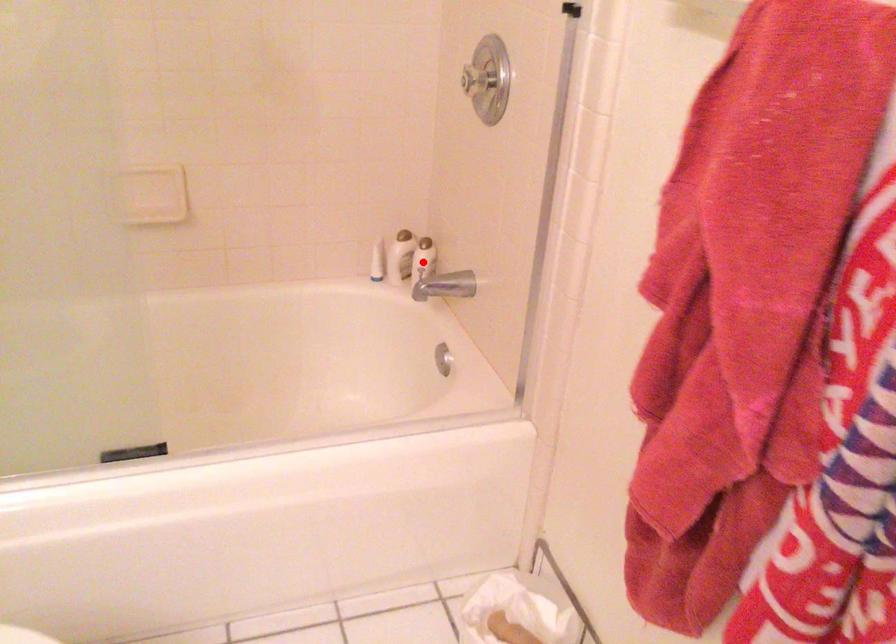
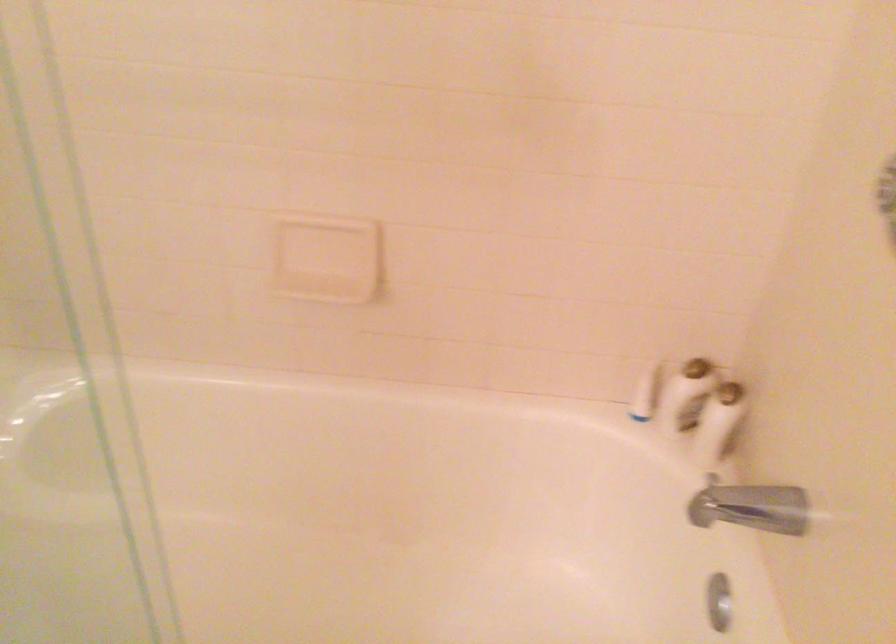
Question: A red point is marked in image1. In image2, is the corresponding 3D point closer to the camera or farther? Reply with the corresponding letter.

Choices:
 (A) The corresponding 3D point is closer.
 (B) The corresponding 3D point is farther.

Answer: (A)